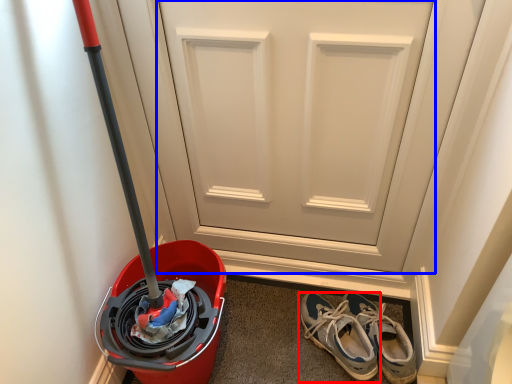
Question: Which object is further to the camera taking this photo, footwear (highlighted by a red box) or door (highlighted by a blue box)?

Choices:
 (A) footwear
 (B) door

Answer: (A)